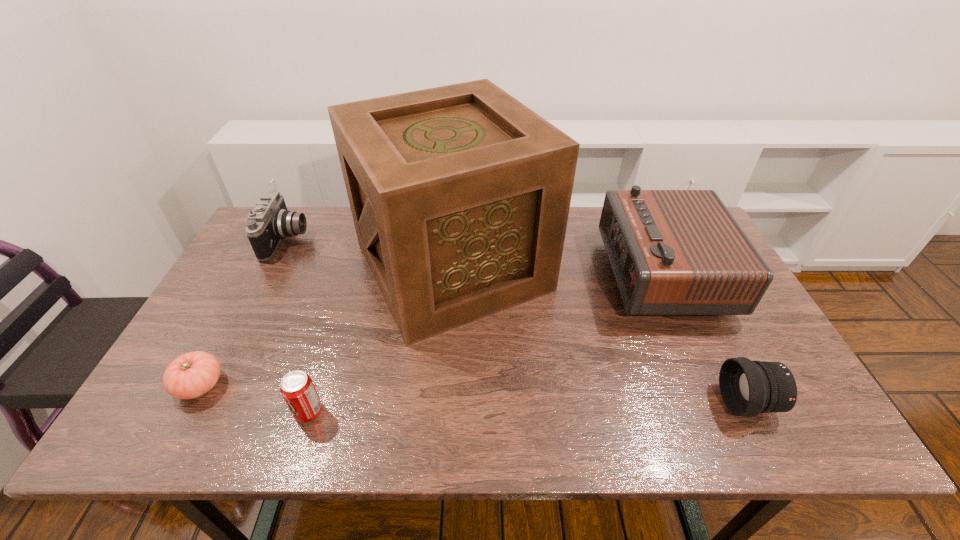
Locate an element on the screen. This screenshot has height=540, width=960. the tallest object is located at coordinates (460, 194).

Identify the location of radio receiver. This screenshot has height=540, width=960. (673, 252).

The width and height of the screenshot is (960, 540). What are the coordinates of `camera` in the screenshot? It's located at (270, 221).

You are a GUI agent. You are given a task and a screenshot of the screen. Output one action in this format:
    pyautogui.click(x=<x>, y=<y>)
    Task: Click on the telephoto lens
    
    Given the screenshot: What is the action you would take?
    pyautogui.click(x=748, y=388)

You are a GUI agent. You are given a task and a screenshot of the screen. Output one action in this format:
    pyautogui.click(x=<x>, y=<y>)
    Task: Click on the soda
    The image size is (960, 540).
    Given the screenshot: What is the action you would take?
    pyautogui.click(x=297, y=388)

Where is `the shortest object`? This screenshot has width=960, height=540. the shortest object is located at coordinates (193, 374).

I want to click on free location located on the left of the box, so click(x=253, y=267).

Locate an element on the screen. free space located 0.130m on the tuning display of the second tallest object is located at coordinates (564, 274).

This screenshot has width=960, height=540. Find the location of `free space located 0.110m on the tuning display of the second tallest object`. free space located 0.110m on the tuning display of the second tallest object is located at coordinates (570, 274).

The image size is (960, 540). What are the coordinates of `vacant space located on the tuning display of the second tallest object` in the screenshot? It's located at (574, 274).